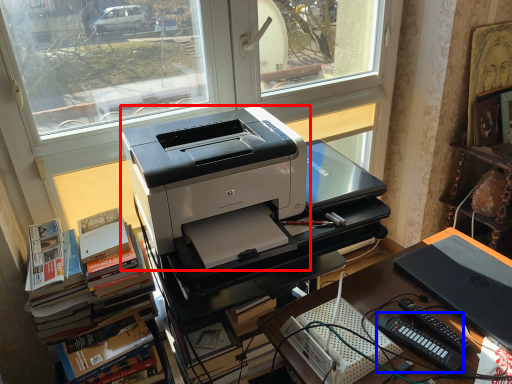
Question: Which point is further to the camera, printer (highlighted by a red box) or equipment (highlighted by a blue box)?

Choices:
 (A) printer
 (B) equipment

Answer: (B)